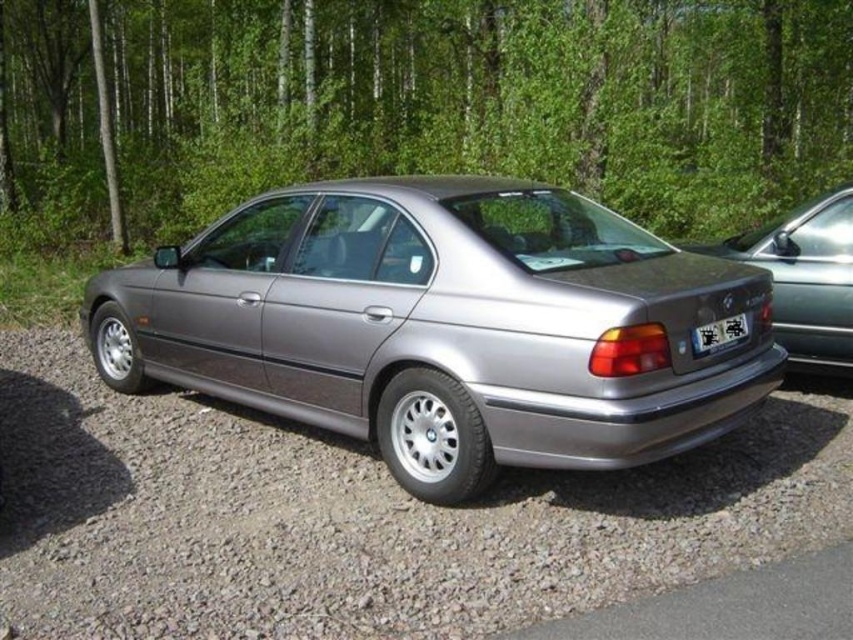
Can you confirm if satin metallic car at center is taller than satin silver car at center?

Yes.

Is satin metallic car at center above satin silver car at center?

Incorrect, satin metallic car at center is not positioned above satin silver car at center.

Which is in front, point (181, 291) or point (757, 243)?

Positioned in front is point (181, 291).

Where is `satin metallic car at center`? This screenshot has height=640, width=853. satin metallic car at center is located at coordinates (444, 324).

Is gray gravel at lower center bigger than satin silver car at center?

No, gray gravel at lower center is not bigger than satin silver car at center.

Describe the element at coordinates (358, 516) in the screenshot. The image size is (853, 640). I see `gray gravel at lower center` at that location.

At what (x,y) coordinates should I click in order to perform the action: click on gray gravel at lower center. Please return your answer as a coordinate pair (x, y). Looking at the image, I should click on (358, 516).

Can you confirm if gray gravel at lower center is wider than gray gravel parking lot at lower left?

Yes, gray gravel at lower center is wider than gray gravel parking lot at lower left.

The image size is (853, 640). I want to click on gray gravel at lower center, so click(x=358, y=516).